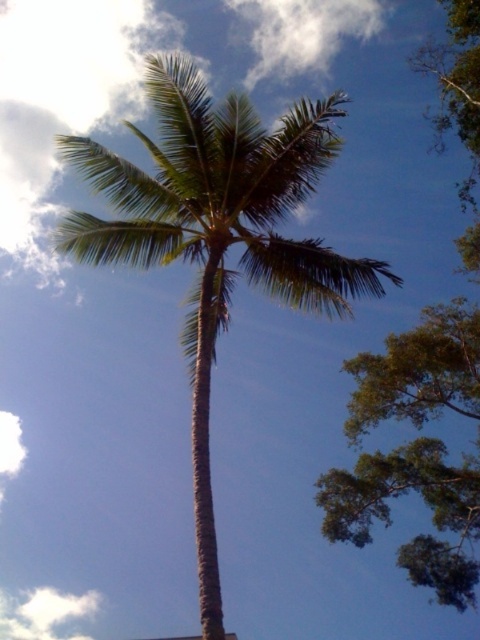
You are standing in a garden and want to take a photo of the green leafy coconut tree at center and the green leafy palm at upper left. Which tree should you focus on first to ensure both are in the frame?

You should focus on the green leafy coconut tree at center first because it is closer to you than the green leafy palm at upper left, so it will be in the foreground. By focusing on the closer object, both will be in the frame.

You are standing in front of the palm tree and want to take a photo. There are two points marked in the image, point [178,93] and point [350,420]. Which point is closer to you?

Point [178,93] is closer to the camera than point [350,420], so it is closer to you.

You are standing at the center of the image and looking towards the point marked at coordinates (216, 234). Based on the scene description, what object is located at that point?

The point at coordinates (216, 234) indicates the green leafy coconut tree at center.